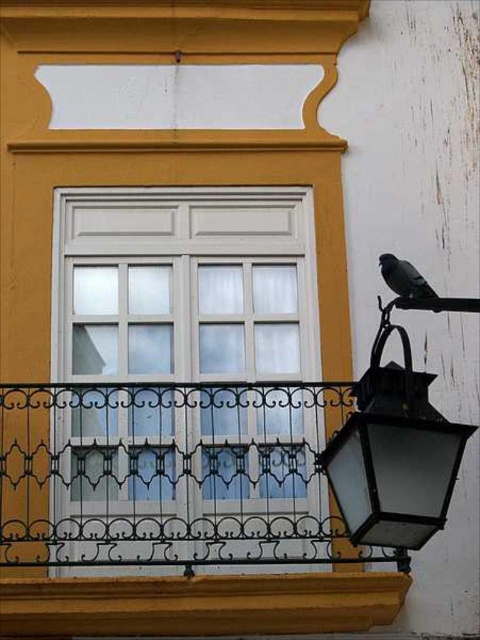
Does white painted wood window at center have a greater height compared to gray matte pigeon at upper right?

Correct, white painted wood window at center is much taller as gray matte pigeon at upper right.

Can you confirm if white painted wood window at center is positioned below gray matte pigeon at upper right?

Indeed, white painted wood window at center is positioned under gray matte pigeon at upper right.

Describe the element at coordinates (186, 372) in the screenshot. This screenshot has width=480, height=640. I see `white painted wood window at center` at that location.

Image resolution: width=480 pixels, height=640 pixels. I want to click on white painted wood window at center, so click(186, 372).

Does black wrought iron at lower right appear on the right side of gray matte pigeon at upper right?

In fact, black wrought iron at lower right is to the left of gray matte pigeon at upper right.

Identify the location of black wrought iron at lower right. This screenshot has width=480, height=640. (178, 513).

Is white painted wood window at center positioned at the back of black wrought iron at lower right?

Result: Yes.

Can you confirm if white painted wood window at center is taller than black wrought iron at lower right?

Yes.

Measure the distance between point (130, 305) and camera.

They are 46.61 feet apart.

I want to click on white painted wood window at center, so click(x=186, y=372).